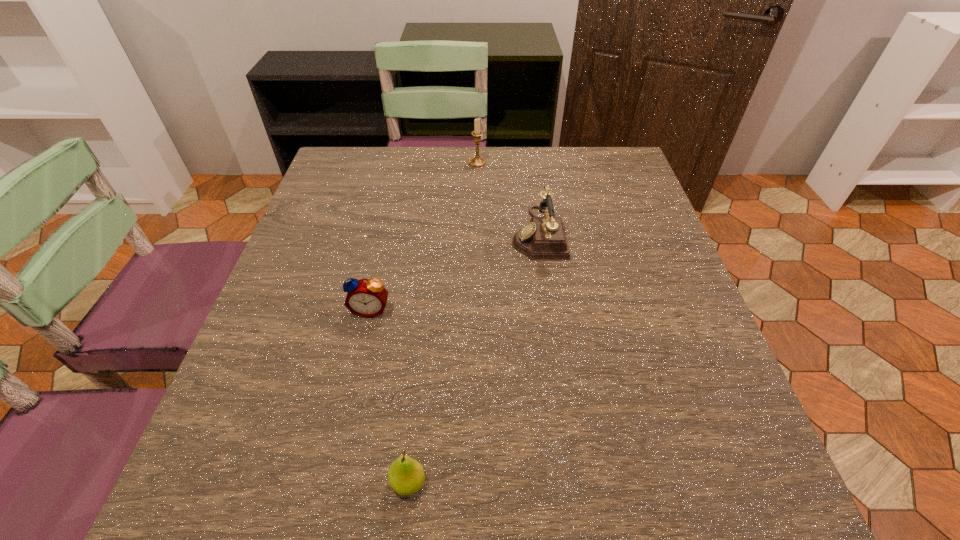
The image size is (960, 540). I want to click on vacant space that is in between the alarm clock and the third object from right to left, so click(x=390, y=396).

Locate which object is the closest to the third object from right to left. Please provide its 2D coordinates. Your answer should be formatted as a tuple, i.e. [(x, y)], where the tuple contains the x and y coordinates of a point satisfying the conditions above.

[(367, 298)]

Identify which object is located as the nearest to the tallest object. Please provide its 2D coordinates. Your answer should be formatted as a tuple, i.e. [(x, y)], where the tuple contains the x and y coordinates of a point satisfying the conditions above.

[(544, 238)]

Locate an element on the screen. Image resolution: width=960 pixels, height=540 pixels. free point that satisfies the following two spatial constraints: 1. on the dial of the third nearest object; 2. on the front-facing side of the alarm clock is located at coordinates (549, 309).

The width and height of the screenshot is (960, 540). Identify the location of vacant space that satisfies the following two spatial constraints: 1. on the dial of the second farthest object; 2. on the front-facing side of the alarm clock. (549, 309).

Locate an element on the screen. free region that satisfies the following two spatial constraints: 1. on the dial of the second farthest object; 2. on the front-facing side of the leftmost object is located at coordinates (549, 309).

Find the location of a particular element. The width and height of the screenshot is (960, 540). free location that satisfies the following two spatial constraints: 1. on the dial of the telephone; 2. on the front side of the pear is located at coordinates (574, 483).

This screenshot has height=540, width=960. Find the location of `vacant region that satisfies the following two spatial constraints: 1. on the front-facing side of the nearest object; 2. on the right side of the second nearest object`. vacant region that satisfies the following two spatial constraints: 1. on the front-facing side of the nearest object; 2. on the right side of the second nearest object is located at coordinates pos(332,483).

Find the location of `vacant space that satisfies the following two spatial constraints: 1. on the front-facing side of the leftmost object; 2. on the right side of the second object from left to right`. vacant space that satisfies the following two spatial constraints: 1. on the front-facing side of the leftmost object; 2. on the right side of the second object from left to right is located at coordinates (332, 483).